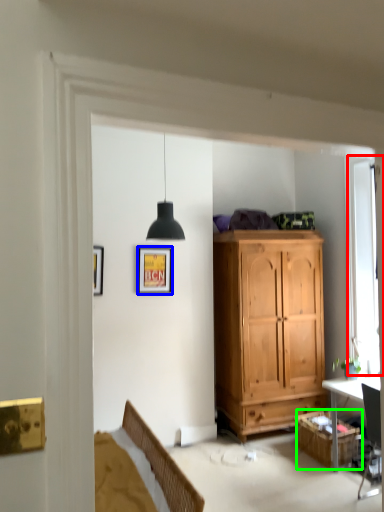
Question: Based on their relative distances, which object is nearer to window (highlighted by a red box)? Choose from picture frame (highlighted by a blue box) and cabinetry (highlighted by a green box).

Choices:
 (A) picture frame
 (B) cabinetry

Answer: (B)